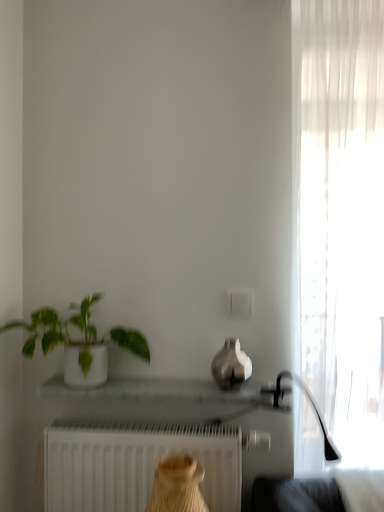
Question: Considering the positions of point (316, 199) and point (77, 370), is point (316, 199) closer or farther from the camera than point (77, 370)?

Choices:
 (A) farther
 (B) closer

Answer: (B)

Question: Is white sheer curtain at right taller or shorter than white glossy pot at left?

Choices:
 (A) tall
 (B) short

Answer: (A)

Question: Which object is the farthest from the white glossy tray at center?

Choices:
 (A) satin silver vase at center
 (B) white sheer curtain at right
 (C) white matte radiator at lower center
 (D) white glossy pot at left

Answer: (B)

Question: Which is nearer to the white sheer curtain at right?

Choices:
 (A) satin silver vase at center
 (B) white glossy pot at left
 (C) white glossy tray at center
 (D) white matte radiator at lower center

Answer: (A)